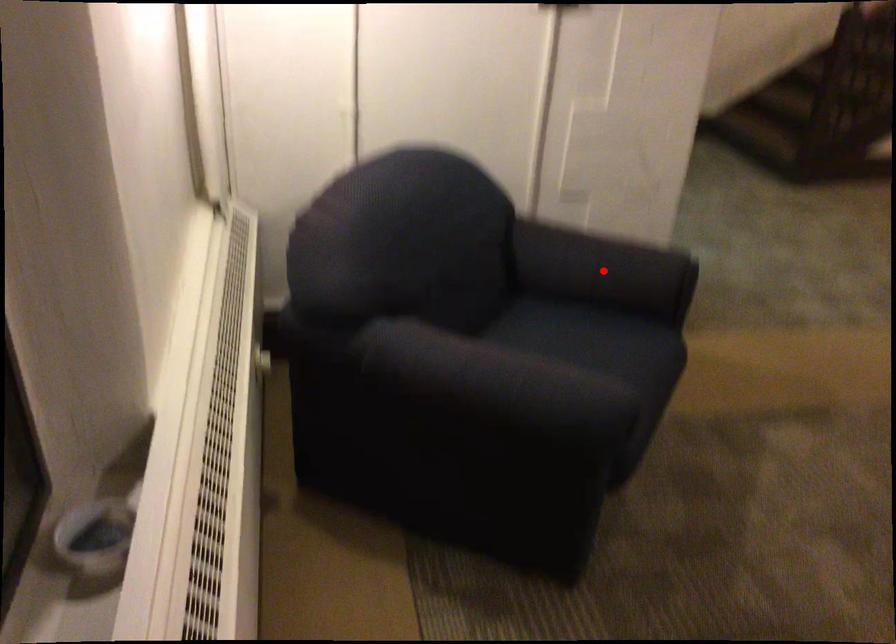
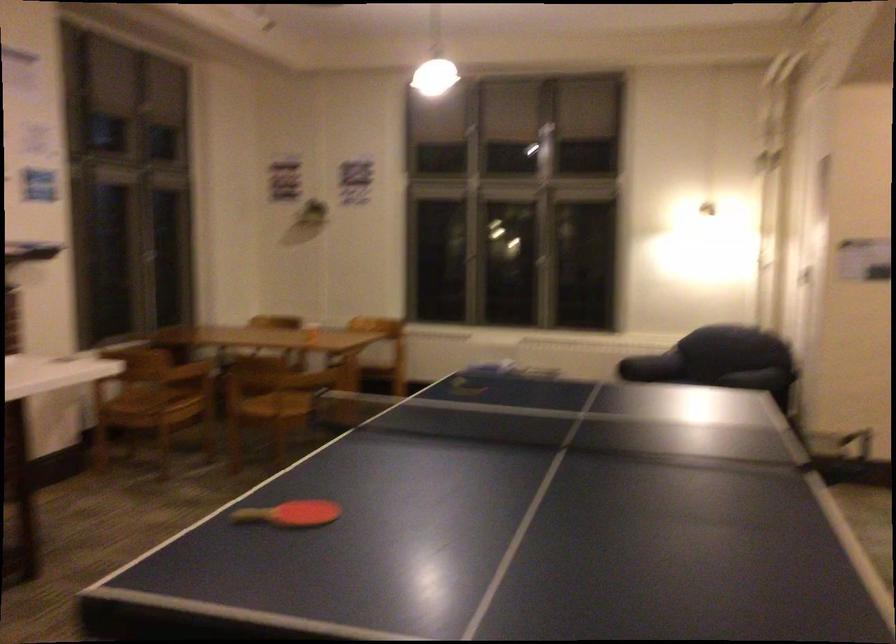
Question: I am providing you with two images of the same scene from different viewpoints. A red point is marked on the first image. Is the red point's position out of view in image 2?

Choices:
 (A) Yes
 (B) No

Answer: (A)